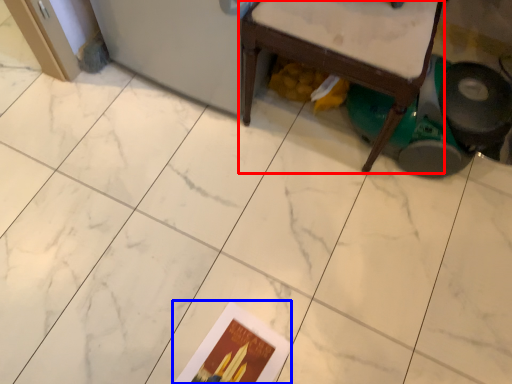
Question: Which of the following is the closest to the observer, furniture (highlighted by a red box) or postcard (highlighted by a blue box)?

Choices:
 (A) furniture
 (B) postcard

Answer: (A)